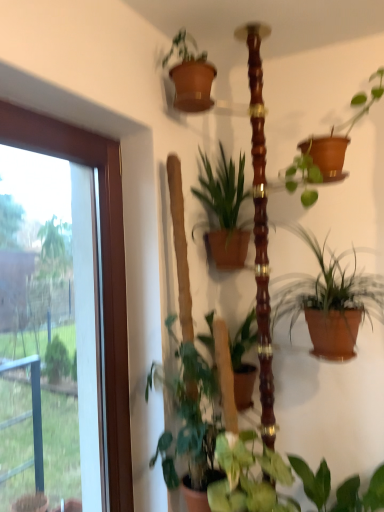
Question: Is green matte plant at center, which ranks as the 4th houseplant in bottom-to-top order, spatially inside terracotta clay pot at center-right, which is the 3th houseplant from bottom to top, or outside of it?

Choices:
 (A) inside
 (B) outside

Answer: (B)

Question: Based on their positions, is green matte plant at center, the 1th houseplant positioned from the top, located to the left or right of terracotta clay pot at center-right, which is the 3th houseplant from bottom to top?

Choices:
 (A) right
 (B) left

Answer: (B)

Question: Which of these objects is positioned closest to the green matte plant at center, the 1th houseplant positioned from the top?

Choices:
 (A) transparent glass door at left
 (B) green glossy plant at center, positioned as the 1th houseplant in bottom-to-top order
 (C) green matte plant at lower left, which is the third houseplant in top-to-bottom order
 (D) terracotta clay pot at center-right, which is the 3th houseplant from bottom to top

Answer: (D)

Question: Which object is the farthest from the green matte plant at lower left, which is the third houseplant in top-to-bottom order?

Choices:
 (A) green glossy plant at center, positioned as the 1th houseplant in bottom-to-top order
 (B) green matte plant at center, which ranks as the 4th houseplant in bottom-to-top order
 (C) terracotta clay pot at center-right, positioned as the 2th houseplant in top-to-bottom order
 (D) transparent glass door at left

Answer: (B)